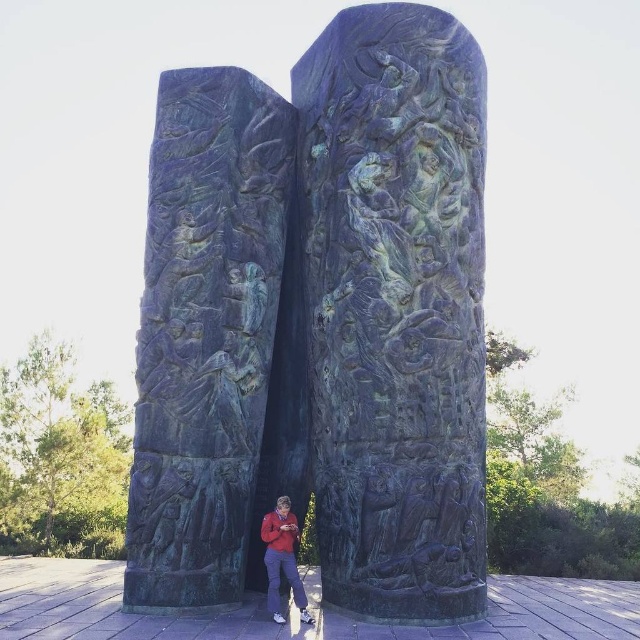
You are a photographer standing in front of the monument. You want to take a photo that includes both the green patina stone carving at center and the matte red jacket at lower center. Based on their positions, which object should you place closer to the left side of your camera frame?

The matte red jacket at lower center should be placed closer to the left side of your camera frame because the green patina stone carving at center is positioned on the right side of it.

You are an archaeologist examining the monument and need to document the position of the green patinated stone relief at center. What are the coordinates of this relief?

The green patinated stone relief at center is located at point (205, 333).

You are an art conservator examining the monument. You notice two similar green patina stone carvings. One is labeled as the green patina stone carving at center and the other as the green patinated stone relief at center. According to the description, which one is positioned to the right of the other?

The green patina stone carving at center is positioned to the right of the green patinated stone relief at center.